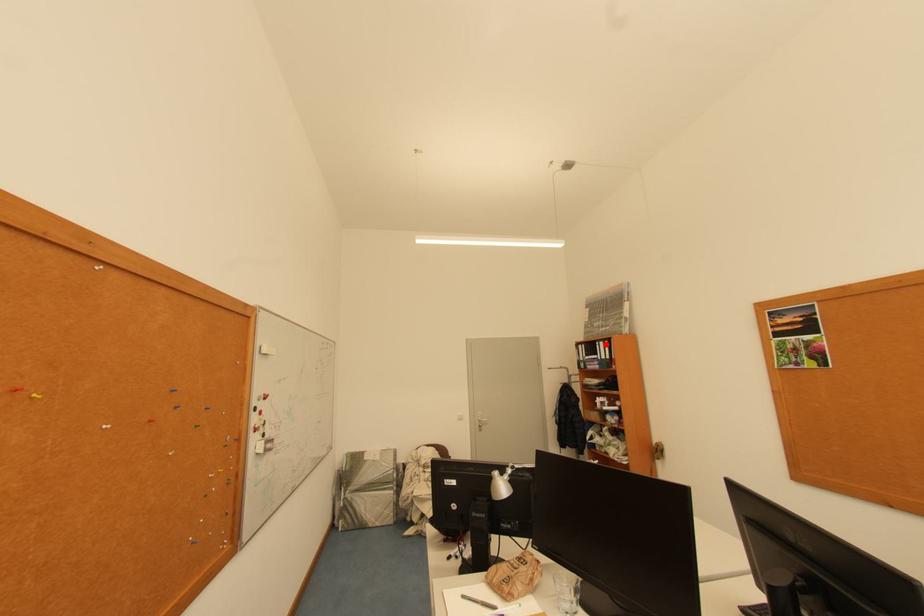
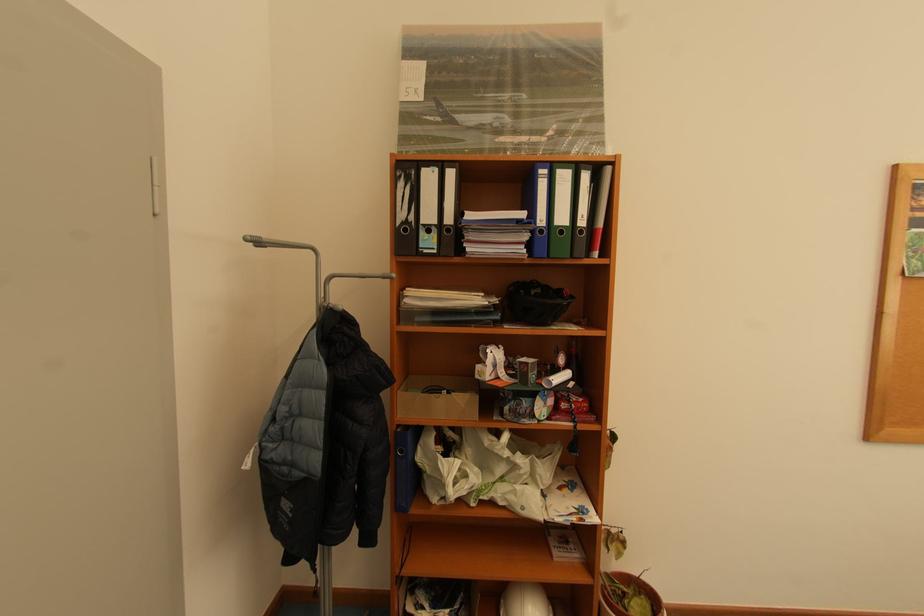
In the second image, find the point that corresponds to the highlighted location in the first image.

(552, 172)